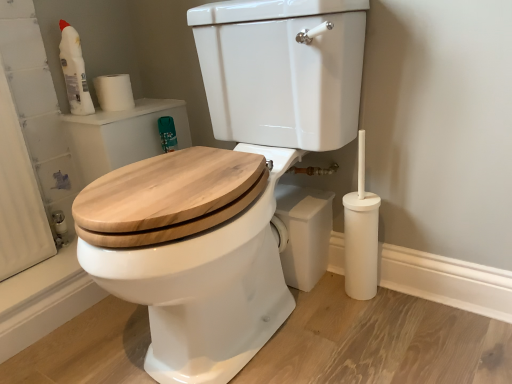
Describe the element at coordinates (361, 235) in the screenshot. The height and width of the screenshot is (384, 512). I see `white plastic toilet brush at lower right` at that location.

What do you see at coordinates (226, 185) in the screenshot? I see `natural wood toilet seat at center` at bounding box center [226, 185].

This screenshot has width=512, height=384. Identify the location of white plastic toilet brush at lower right. (361, 235).

Between white plastic toilet brush at lower right and white plastic bottle at upper left, which one has more height?

Standing taller between the two is white plastic toilet brush at lower right.

Is white plastic toilet brush at lower right in contact with white plastic bottle at upper left?

No.

From a real-world perspective, who is located higher, white plastic toilet brush at lower right or white plastic bottle at upper left?

From a 3D spatial view, white plastic bottle at upper left is above.

Can you confirm if white plastic toilet brush at lower right is smaller than white plastic bottle at upper left?

Incorrect, white plastic toilet brush at lower right is not smaller in size than white plastic bottle at upper left.

In terms of width, does white plastic bottle at upper left look wider or thinner when compared to white plastic toilet brush at lower right?

Considering their sizes, white plastic bottle at upper left looks slimmer than white plastic toilet brush at lower right.

Considering the sizes of objects white plastic bottle at upper left and white plastic toilet brush at lower right in the image provided, who is shorter, white plastic bottle at upper left or white plastic toilet brush at lower right?

white plastic bottle at upper left.

Could you tell me if white plastic bottle at upper left is facing white plastic toilet brush at lower right?

No, white plastic bottle at upper left is not facing towards white plastic toilet brush at lower right.

How different are the orientations of white matte toilet paper at upper left and white plastic bottle at upper left in degrees?

white matte toilet paper at upper left and white plastic bottle at upper left are facing 0.0086 degrees away from each other.

Between white matte toilet paper at upper left and white plastic bottle at upper left, which one has larger width?

With larger width is white matte toilet paper at upper left.

What are the coordinates of `cleaning product in front of the white matte toilet paper at upper left` in the screenshot? It's located at (74, 71).

Does white matte toilet paper at upper left come in front of white plastic bottle at upper left?

No, white matte toilet paper at upper left is behind white plastic bottle at upper left.

Which is more to the left, white matte toilet paper at upper left or white plastic toilet brush at lower right?

white matte toilet paper at upper left.

Is white matte toilet paper at upper left inside or outside of white plastic toilet brush at lower right?

white matte toilet paper at upper left cannot be found inside white plastic toilet brush at lower right.

Which object is wider, white matte toilet paper at upper left or white plastic toilet brush at lower right?

With larger width is white plastic toilet brush at lower right.

Relative to white plastic toilet brush at lower right, is white matte toilet paper at upper left in front or behind?

white matte toilet paper at upper left is behind white plastic toilet brush at lower right.

How distant is white plastic bottle at upper left from natural wood toilet seat at center?

62.94 centimeters.

Considering the points (80, 62) and (244, 146), which point is in front, point (80, 62) or point (244, 146)?

The point (244, 146) is more forward.

Between white plastic bottle at upper left and natural wood toilet seat at center, which one has smaller size?

With smaller size is white plastic bottle at upper left.

From a real-world perspective, which is physically above, white plastic bottle at upper left or natural wood toilet seat at center?

white plastic bottle at upper left, from a real-world perspective.

Who is taller, natural wood toilet seat at center or white plastic bottle at upper left?

natural wood toilet seat at center is taller.

From a real-world perspective, is natural wood toilet seat at center physically located above or below white plastic bottle at upper left?

Clearly, from a real-world perspective, natural wood toilet seat at center is below white plastic bottle at upper left.

In the image, there is a white plastic bottle at upper left. In order to click on toilet below it (from the image's perspective) in this screenshot , I will do `click(226, 185)`.

How much distance is there between natural wood toilet seat at center and white plastic bottle at upper left?

natural wood toilet seat at center and white plastic bottle at upper left are 62.94 centimeters apart from each other.

Locate an element on the screen. Image resolution: width=512 pixels, height=384 pixels. toilet paper that appears on the left of natural wood toilet seat at center is located at coordinates (114, 92).

How distant is natural wood toilet seat at center from white matte toilet paper at upper left?

natural wood toilet seat at center and white matte toilet paper at upper left are 59.86 centimeters apart.

Can white matte toilet paper at upper left be found inside natural wood toilet seat at center?

No, white matte toilet paper at upper left is not surrounded by natural wood toilet seat at center.

Locate an element on the screen. cleaning product above the white plastic toilet brush at lower right (from a real-world perspective) is located at coordinates (74, 71).

The width and height of the screenshot is (512, 384). In the image, there is a white plastic bottle at upper left. Identify the location of brush below it (from a real-world perspective). (361, 235).

Considering their positions, is natural wood toilet seat at center positioned closer to white matte toilet paper at upper left than white plastic bottle at upper left?

white plastic bottle at upper left is positioned closer to the anchor white matte toilet paper at upper left.

When comparing their distances from white plastic toilet brush at lower right, does natural wood toilet seat at center or white matte toilet paper at upper left seem further?

Based on the image, white matte toilet paper at upper left appears to be further to white plastic toilet brush at lower right.

Estimate the real-world distances between objects in this image. Which object is closer to white plastic toilet brush at lower right, white matte toilet paper at upper left or white plastic bottle at upper left?

Based on the image, white matte toilet paper at upper left appears to be nearer to white plastic toilet brush at lower right.

Based on their spatial positions, is white plastic bottle at upper left or white plastic toilet brush at lower right closer to natural wood toilet seat at center?

white plastic toilet brush at lower right.

Considering their positions, is white plastic bottle at upper left positioned closer to white matte toilet paper at upper left than white plastic toilet brush at lower right?

white plastic bottle at upper left lies closer to white matte toilet paper at upper left than the other object.

Estimate the real-world distances between objects in this image. Which object is further from natural wood toilet seat at center, white plastic toilet brush at lower right or white plastic bottle at upper left?

Among the two, white plastic bottle at upper left is located further to natural wood toilet seat at center.

Which object lies further to the anchor point white matte toilet paper at upper left, white plastic bottle at upper left or natural wood toilet seat at center?

Among the two, natural wood toilet seat at center is located further to white matte toilet paper at upper left.

Looking at the image, which one is located further to natural wood toilet seat at center, white matte toilet paper at upper left or white plastic bottle at upper left?

white plastic bottle at upper left is positioned further to the anchor natural wood toilet seat at center.

The width and height of the screenshot is (512, 384). I want to click on toilet located between white plastic bottle at upper left and white plastic toilet brush at lower right in the left-right direction, so 226,185.

Where is `brush positioned between natural wood toilet seat at center and white matte toilet paper at upper left from near to far`? brush positioned between natural wood toilet seat at center and white matte toilet paper at upper left from near to far is located at coordinates (361, 235).

The width and height of the screenshot is (512, 384). What are the coordinates of `toilet paper between white plastic bottle at upper left and white plastic toilet brush at lower right from left to right` in the screenshot? It's located at (114, 92).

The height and width of the screenshot is (384, 512). In order to click on cleaning product between natural wood toilet seat at center and white matte toilet paper at upper left along the z-axis in this screenshot , I will do `click(74, 71)`.